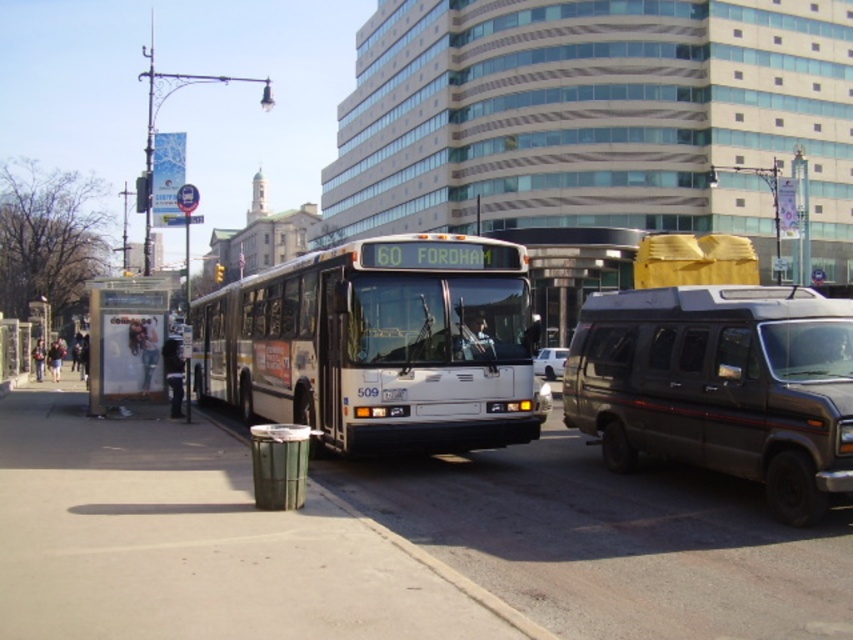
Question: Does white metallic bus at center have a lesser width compared to denim jacket at lower left?

Choices:
 (A) yes
 (B) no

Answer: (B)

Question: Considering the relative positions of white metallic bus at center and transparent glass bus stop at left in the image provided, where is white metallic bus at center located with respect to transparent glass bus stop at left?

Choices:
 (A) below
 (B) above

Answer: (B)

Question: Considering the real-world distances, which object is farthest from the smooth concrete pavement at lower center?

Choices:
 (A) dark gray matte van at right
 (B) white metallic bus at center

Answer: (A)

Question: Which point appears closest to the camera in this image?

Choices:
 (A) (71, 545)
 (B) (119, 296)
 (C) (41, 364)
 (D) (498, 444)

Answer: (A)

Question: Which of the following is the farthest from the observer?

Choices:
 (A) pyautogui.click(x=643, y=296)
 (B) pyautogui.click(x=56, y=346)
 (C) pyautogui.click(x=358, y=285)
 (D) pyautogui.click(x=129, y=289)

Answer: (B)

Question: Is white metallic bus at center behind white matte van at center?

Choices:
 (A) no
 (B) yes

Answer: (A)